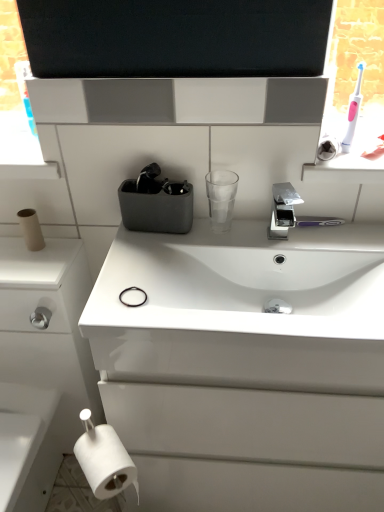
Question: Considering the relative positions of pink plastic toothbrush at upper right and chrome metallic faucet at center in the image provided, is pink plastic toothbrush at upper right to the left of chrome metallic faucet at center from the viewer's perspective?

Choices:
 (A) yes
 (B) no

Answer: (B)

Question: Is the position of pink plastic toothbrush at upper right more distant than that of chrome metallic faucet at center?

Choices:
 (A) yes
 (B) no

Answer: (A)

Question: Is chrome metallic faucet at center inside pink plastic toothbrush at upper right?

Choices:
 (A) yes
 (B) no

Answer: (B)

Question: From the image's perspective, is pink plastic toothbrush at upper right under chrome metallic faucet at center?

Choices:
 (A) yes
 (B) no

Answer: (B)

Question: Considering the relative sizes of pink plastic toothbrush at upper right and chrome metallic faucet at center in the image provided, is pink plastic toothbrush at upper right shorter than chrome metallic faucet at center?

Choices:
 (A) no
 (B) yes

Answer: (A)

Question: Considering the relative positions of white cardboard toilet paper at left, marked as the first toilet paper in a top-to-bottom arrangement, and white glossy cabinet at lower left in the image provided, is white cardboard toilet paper at left, marked as the first toilet paper in a top-to-bottom arrangement, to the left or to the right of white glossy cabinet at lower left?

Choices:
 (A) left
 (B) right

Answer: (B)

Question: Considering their positions, is white cardboard toilet paper at left, positioned as the second toilet paper in right-to-left order, located in front of or behind white glossy cabinet at lower left?

Choices:
 (A) front
 (B) behind

Answer: (B)

Question: In terms of height, does white cardboard toilet paper at left, which appears as the 1th toilet paper when viewed from the back, look taller or shorter compared to white glossy cabinet at lower left?

Choices:
 (A) tall
 (B) short

Answer: (B)

Question: In terms of width, does white cardboard toilet paper at left, which is counted as the first toilet paper, starting from the left, look wider or thinner when compared to white glossy cabinet at lower left?

Choices:
 (A) wide
 (B) thin

Answer: (B)

Question: Relative to white cardboard toilet paper at left, placed as the 2th toilet paper when sorted from front to back, is pink plastic toothbrush at upper right in front or behind?

Choices:
 (A) behind
 (B) front

Answer: (B)

Question: From the image's perspective, is pink plastic toothbrush at upper right positioned above or below white cardboard toilet paper at left, which appears as the 1th toilet paper when viewed from the back?

Choices:
 (A) below
 (B) above

Answer: (B)

Question: In terms of height, does pink plastic toothbrush at upper right look taller or shorter compared to white cardboard toilet paper at left, which appears as the 1th toilet paper when viewed from the back?

Choices:
 (A) short
 (B) tall

Answer: (B)

Question: Do you think pink plastic toothbrush at upper right is within white cardboard toilet paper at left, placed as the 2th toilet paper when sorted from front to back, or outside of it?

Choices:
 (A) outside
 (B) inside

Answer: (A)

Question: Looking at their shapes, would you say chrome metallic faucet at center is wider or thinner than white matte toilet paper at lower left, placed as the second toilet paper when sorted from left to right?

Choices:
 (A) wide
 (B) thin

Answer: (A)

Question: Is point (291, 193) positioned closer to the camera than point (79, 439)?

Choices:
 (A) closer
 (B) farther

Answer: (B)